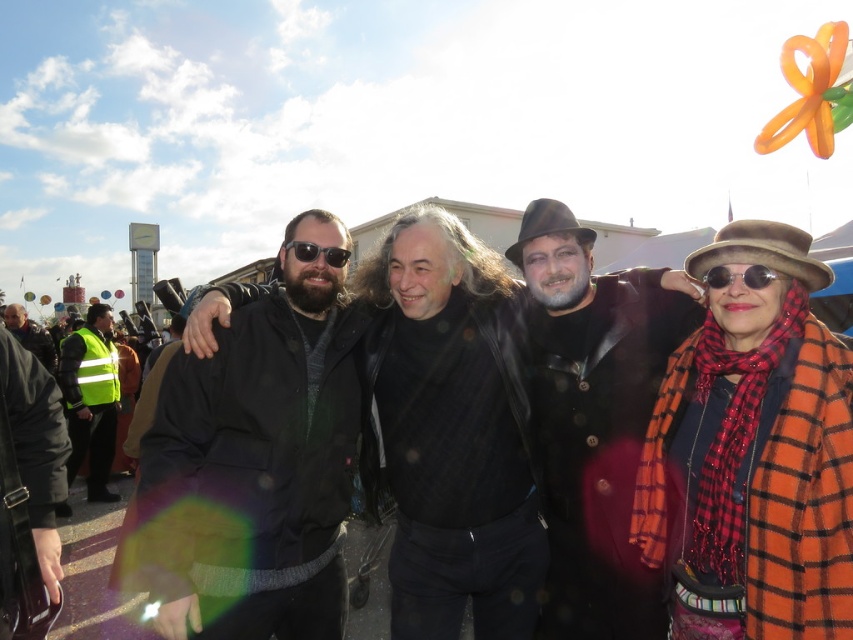
Is point (316, 332) farther from viewer compared to point (349, 250)?

That is False.

Who is taller, black matte jacket at left or matte black sunglasses at center?

black matte jacket at left

Locate an element on the screen. This screenshot has height=640, width=853. black matte jacket at left is located at coordinates (254, 467).

Does high-visibility yellow vest at left lie in front of sunglasses at right?

No, high-visibility yellow vest at left is behind sunglasses at right.

Does high-visibility yellow vest at left appear under sunglasses at right?

Correct, high-visibility yellow vest at left is located below sunglasses at right.

I want to click on high-visibility yellow vest at left, so click(91, 400).

Where is `high-visibility yellow vest at left`? high-visibility yellow vest at left is located at coordinates (91, 400).

Which of these two, orange plaid coat at right or black leather jacket at center, stands taller?

Standing taller between the two is black leather jacket at center.

Is point (706, 294) in front of point (628, 344)?

Yes, it is in front of point (628, 344).

Between point (844, 512) and point (548, 449), which one is positioned behind?

Point (548, 449)

You are a GUI agent. You are given a task and a screenshot of the screen. Output one action in this format:
    pyautogui.click(x=<x>, y=<y>)
    Task: Click on the orange plaid coat at right
    This screenshot has width=853, height=640.
    Given the screenshot: What is the action you would take?
    pyautogui.click(x=753, y=454)